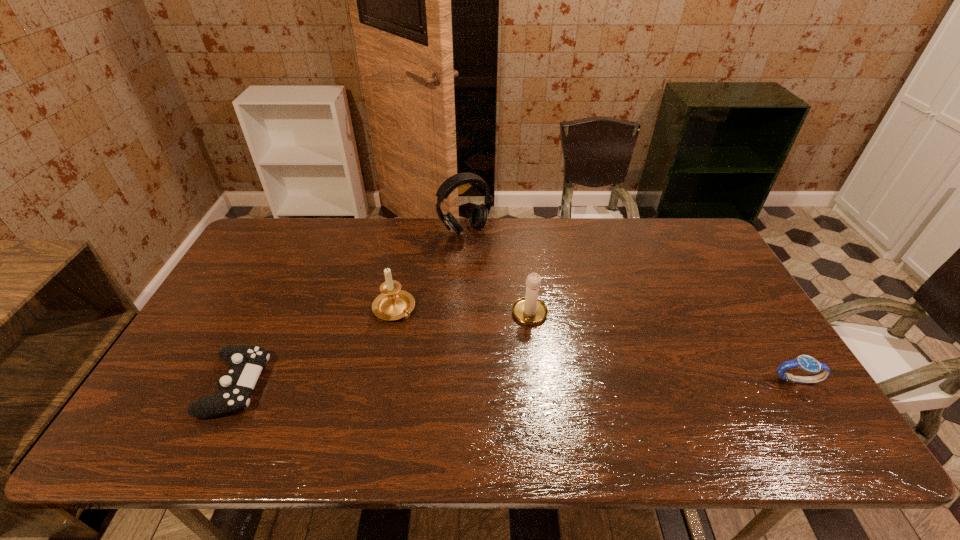
The image size is (960, 540). In order to click on free space on the desktop that is between the control and the watch and is positioned on the ear cups of the earphone in this screenshot , I will do `click(575, 382)`.

Find the location of a particular element. vacant space on the desktop that is between the control and the watch and is positioned with a handle on the side of the left candle holder is located at coordinates (482, 383).

Where is `vacant spot on the desktop that is between the leftmost object and the rightmost object and is positioned on the handle side of the second object from right to left`? vacant spot on the desktop that is between the leftmost object and the rightmost object and is positioned on the handle side of the second object from right to left is located at coordinates (515, 382).